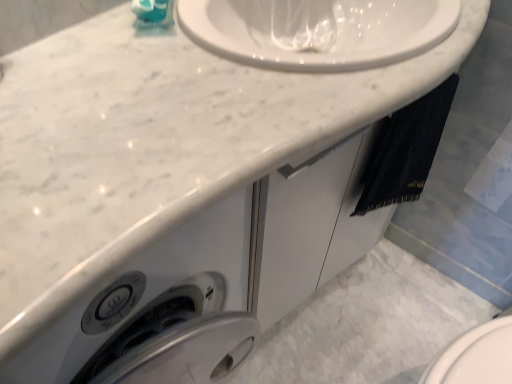
Where is `vacant area situated to the left side of teal glossy soap dispenser at upper left`? vacant area situated to the left side of teal glossy soap dispenser at upper left is located at coordinates (92, 31).